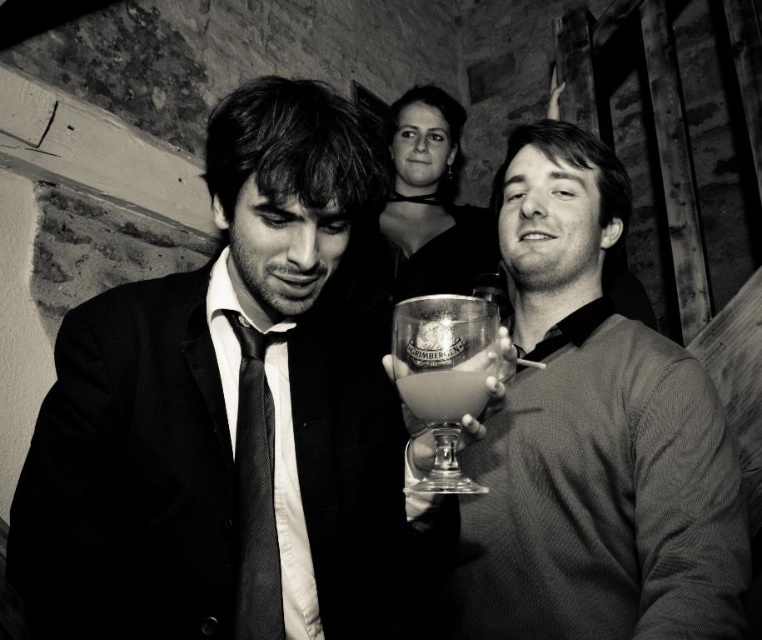
Between transparent glass goblet at center and translucent glass goblet at center, which one has less height?

Standing shorter between the two is translucent glass goblet at center.

Who is more forward, (404, 381) or (456, 420)?

Positioned in front is point (404, 381).

The width and height of the screenshot is (762, 640). Find the location of `transparent glass goblet at center`. transparent glass goblet at center is located at coordinates (444, 374).

Between matte black suit at center and transparent glass goblet at center, which one appears on the left side from the viewer's perspective?

Positioned to the left is matte black suit at center.

Is point (98, 365) farther from viewer compared to point (479, 392)?

Yes.

Image resolution: width=762 pixels, height=640 pixels. In order to click on matte black suit at center in this screenshot , I will do `click(223, 416)`.

Who is lower down, matte black suit at center or smooth glass goblet at center?

matte black suit at center is below.

The width and height of the screenshot is (762, 640). In order to click on matte black suit at center in this screenshot , I will do [223, 416].

This screenshot has width=762, height=640. I want to click on matte black suit at center, so click(223, 416).

Find the location of a particular element. matte black suit at center is located at coordinates (223, 416).